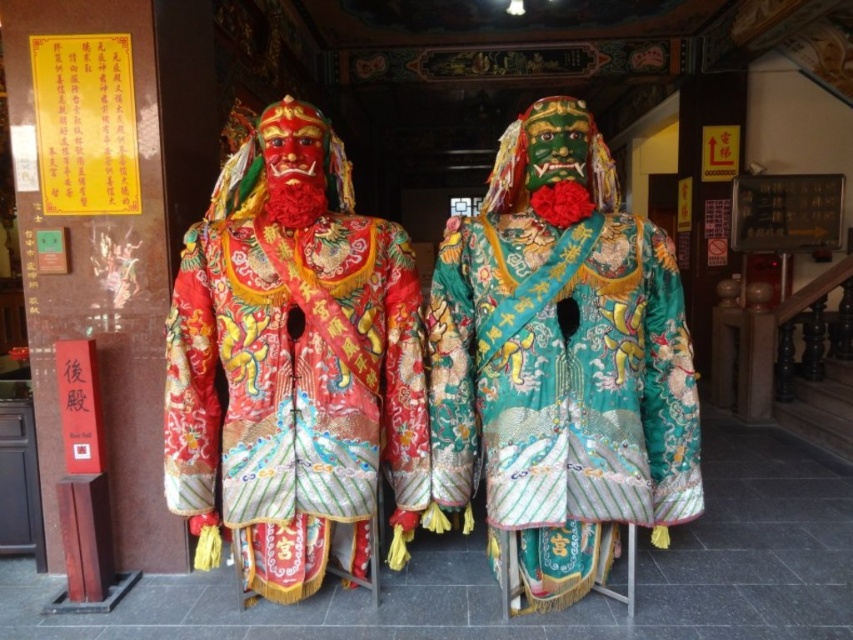
How distant is shiny silk robe at center from green satin robe at center?

shiny silk robe at center is 16.59 inches from green satin robe at center.

Who is more forward, (221, 432) or (502, 145)?

Point (221, 432) is more forward.

Locate an element on the screen. The width and height of the screenshot is (853, 640). shiny silk robe at center is located at coordinates (292, 364).